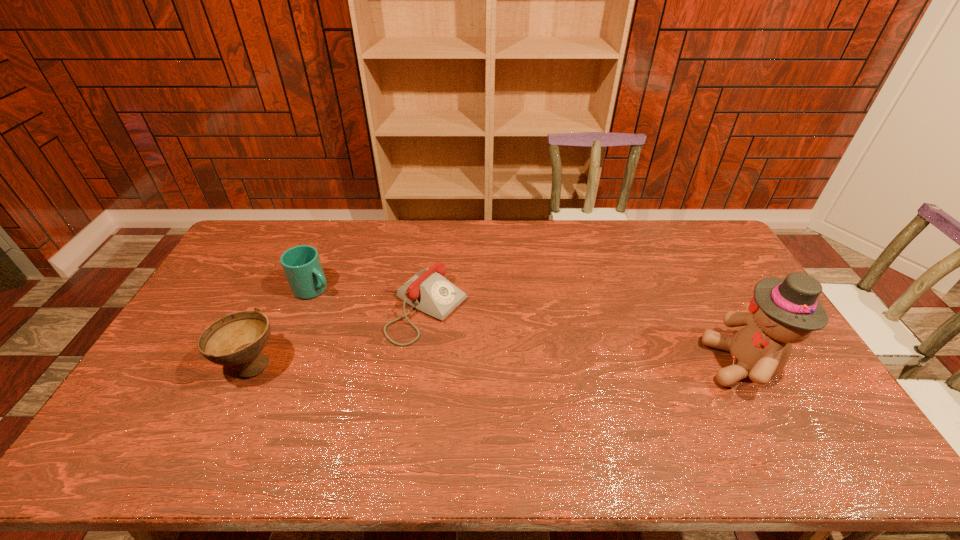
At what (x,y) coordinates should I click in order to perform the action: click on free location at the near edge. Please return your answer as a coordinate pair (x, y). This screenshot has width=960, height=540. Looking at the image, I should click on (653, 409).

This screenshot has width=960, height=540. I want to click on free space at the left edge of the desktop, so click(263, 261).

I want to click on vacant space at the far left corner of the desktop, so click(270, 227).

In the image, there is a desktop. Where is `free space at the far right corner`? Image resolution: width=960 pixels, height=540 pixels. free space at the far right corner is located at coordinates (726, 258).

Identify the location of vacant space in between the soup bowl and the cup. The height and width of the screenshot is (540, 960). (282, 327).

Locate an element on the screen. vacant region between the tallest object and the telephone is located at coordinates (584, 336).

This screenshot has height=540, width=960. In order to click on free space between the rag_doll and the cup in this screenshot , I will do `click(528, 326)`.

This screenshot has height=540, width=960. What are the coordinates of `empty location between the cup and the rag_doll` in the screenshot? It's located at (528, 326).

Identify the location of unoccupied area between the cup and the third object from left to right. (369, 299).

This screenshot has height=540, width=960. Find the location of `vacant area that lies between the shortest object and the cup`. vacant area that lies between the shortest object and the cup is located at coordinates (369, 299).